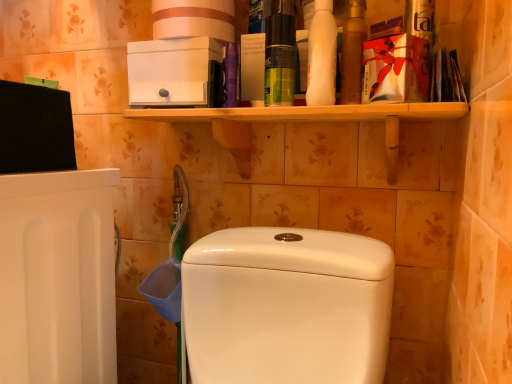
Question: From a real-world perspective, does white cardboard toilet paper at upper center stand above white matte bottle at upper right, arranged as the second cleaning product when viewed from the left?

Choices:
 (A) no
 (B) yes

Answer: (B)

Question: Is white cardboard toilet paper at upper center not near white matte bottle at upper right, arranged as the second cleaning product when viewed from the left?

Choices:
 (A) no
 (B) yes

Answer: (A)

Question: From the image's perspective, is white cardboard toilet paper at upper center under white matte bottle at upper right, arranged as the second cleaning product when viewed from the left?

Choices:
 (A) no
 (B) yes

Answer: (A)

Question: Considering the relative positions of white cardboard toilet paper at upper center and white matte bottle at upper right, arranged as the second cleaning product when viewed from the left, in the image provided, is white cardboard toilet paper at upper center in front of white matte bottle at upper right, arranged as the second cleaning product when viewed from the left,?

Choices:
 (A) no
 (B) yes

Answer: (A)

Question: Considering the relative sizes of white cardboard toilet paper at upper center and white matte bottle at upper right, arranged as the second cleaning product when viewed from the left, in the image provided, is white cardboard toilet paper at upper center bigger than white matte bottle at upper right, arranged as the second cleaning product when viewed from the left,?

Choices:
 (A) no
 (B) yes

Answer: (B)

Question: Is white cardboard toilet paper at upper center not inside white matte bottle at upper right, the 1th cleaning product when ordered from right to left?

Choices:
 (A) no
 (B) yes

Answer: (B)

Question: Does white glossy toilet at center have a lesser height compared to white cardboard toilet paper at upper center?

Choices:
 (A) no
 (B) yes

Answer: (A)

Question: Can you confirm if white glossy toilet at center is thinner than white cardboard toilet paper at upper center?

Choices:
 (A) yes
 (B) no

Answer: (B)

Question: Is white glossy toilet at center not within white cardboard toilet paper at upper center?

Choices:
 (A) no
 (B) yes

Answer: (B)

Question: From the image's perspective, is white glossy toilet at center over white cardboard toilet paper at upper center?

Choices:
 (A) no
 (B) yes

Answer: (A)

Question: Would you consider white glossy toilet at center to be distant from white cardboard toilet paper at upper center?

Choices:
 (A) yes
 (B) no

Answer: (B)

Question: Considering the relative positions of white glossy toilet at center and white cardboard toilet paper at upper center in the image provided, is white glossy toilet at center to the right of white cardboard toilet paper at upper center from the viewer's perspective?

Choices:
 (A) no
 (B) yes

Answer: (B)

Question: Is white cardboard toilet paper at upper center facing away from gold metallic mouthwash at upper right?

Choices:
 (A) no
 (B) yes

Answer: (A)